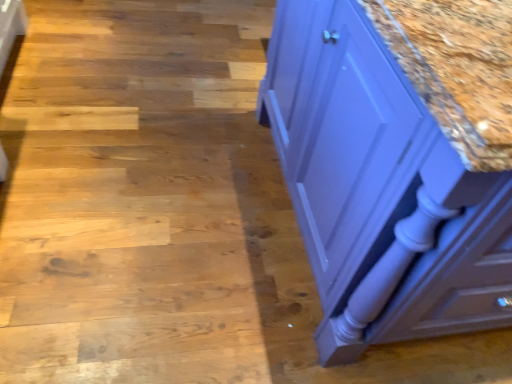
Measure the distance between matte purple cabinet at right and camera.

A distance of 63.06 centimeters exists between matte purple cabinet at right and camera.

What do you see at coordinates (379, 189) in the screenshot? The height and width of the screenshot is (384, 512). I see `matte purple cabinet at right` at bounding box center [379, 189].

The image size is (512, 384). Find the location of `matte purple cabinet at right`. matte purple cabinet at right is located at coordinates (379, 189).

Where is `matte purple cabinet at right`? matte purple cabinet at right is located at coordinates (379, 189).